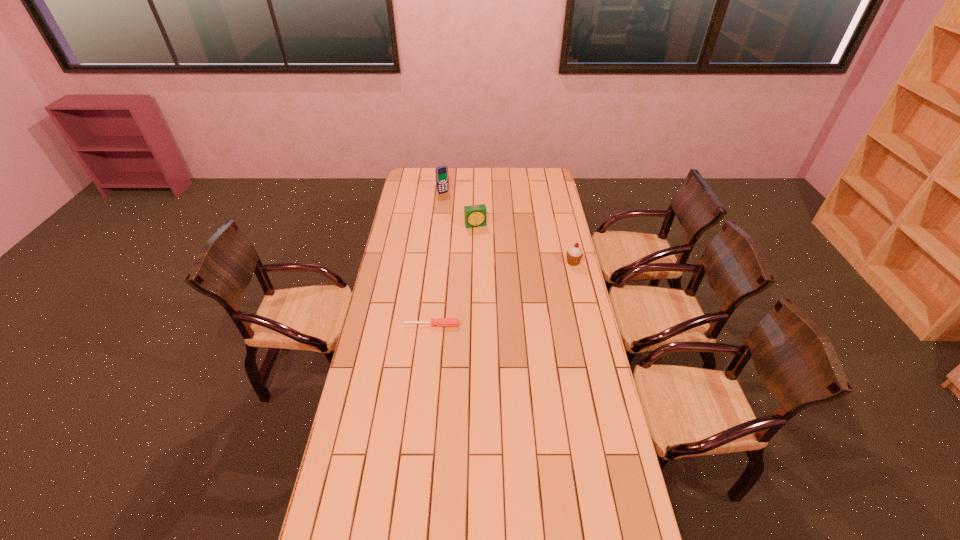
Image resolution: width=960 pixels, height=540 pixels. In the image, there is a desktop. Find the location of `free region at the left edge`. free region at the left edge is located at coordinates (396, 253).

Find the location of a particular element. free space at the right edge is located at coordinates (541, 203).

The image size is (960, 540). In the image, there is a desktop. What are the coordinates of `free space at the near right corner` in the screenshot? It's located at pos(626,521).

Locate an element on the screen. free space between the farthest object and the screwdriver is located at coordinates (438, 259).

Find the location of a particular element. The width and height of the screenshot is (960, 540). vacant area between the third farthest object and the second object from right to left is located at coordinates (524, 244).

At what (x,y) coordinates should I click in order to perform the action: click on unoccupied area between the shortest object and the cellular telephone. Please return your answer as a coordinate pair (x, y). Image resolution: width=960 pixels, height=540 pixels. Looking at the image, I should click on (438, 259).

The height and width of the screenshot is (540, 960). I want to click on free point between the screwdriver and the third object from left to right, so click(454, 275).

In order to click on vacant space in between the shortest object and the alarm clock in this screenshot , I will do `click(454, 275)`.

You are a GUI agent. You are given a task and a screenshot of the screen. Output one action in this format:
    pyautogui.click(x=<x>, y=<y>)
    Task: Click on the free space between the shortest object and the cellular telephone
    
    Given the screenshot: What is the action you would take?
    pyautogui.click(x=438, y=259)

At what (x,y) coordinates should I click in order to perform the action: click on unoccupied area between the tallest object and the cupcake. Please return your answer as a coordinate pair (x, y). Looking at the image, I should click on (508, 227).